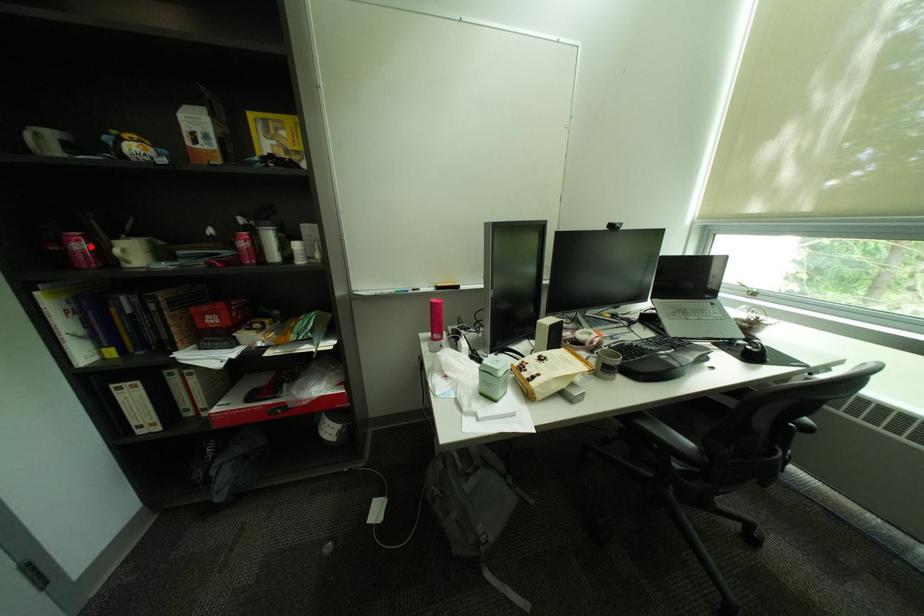
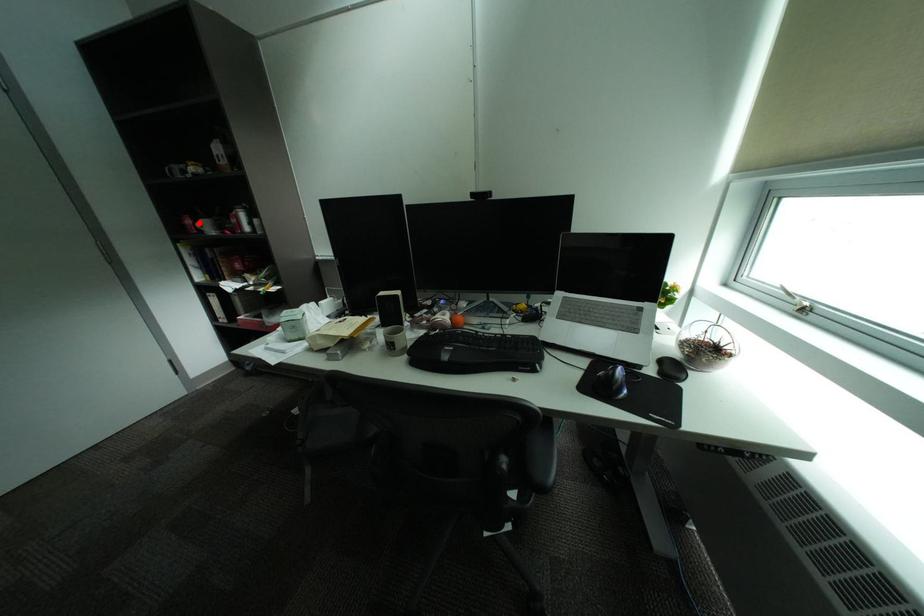
I am providing you with two images of the same scene from different viewpoints. A red point is marked on the first image and another point is marked on the second image. Are the points marked in image1 and image2 representing the same 3D position?

Yes